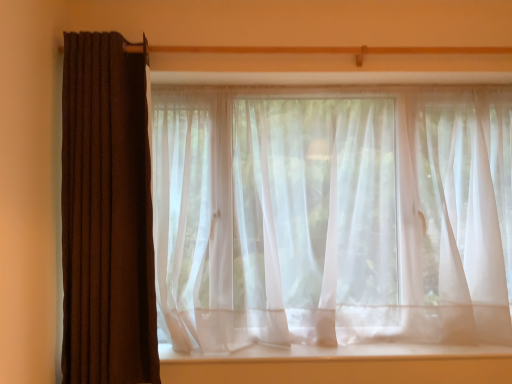
Question: Does point (278, 321) appear closer or farther from the camera than point (291, 352)?

Choices:
 (A) closer
 (B) farther

Answer: (B)

Question: Would you say sheer white curtain at center, acting as the second curtain starting from the left, is to the left or to the right of white sheer fabric at center in the picture?

Choices:
 (A) right
 (B) left

Answer: (A)

Question: Estimate the real-world distances between objects in this image. Which object is farther from the white sheer fabric at center?

Choices:
 (A) sheer white curtain at center, the 1th curtain from the right
 (B) brown textured curtain at left, which is the 1th curtain in left-to-right order

Answer: (B)

Question: Which object is the closest to the brown textured curtain at left, which is the 1th curtain in left-to-right order?

Choices:
 (A) white sheer fabric at center
 (B) sheer white curtain at center, the 1th curtain from the right

Answer: (B)